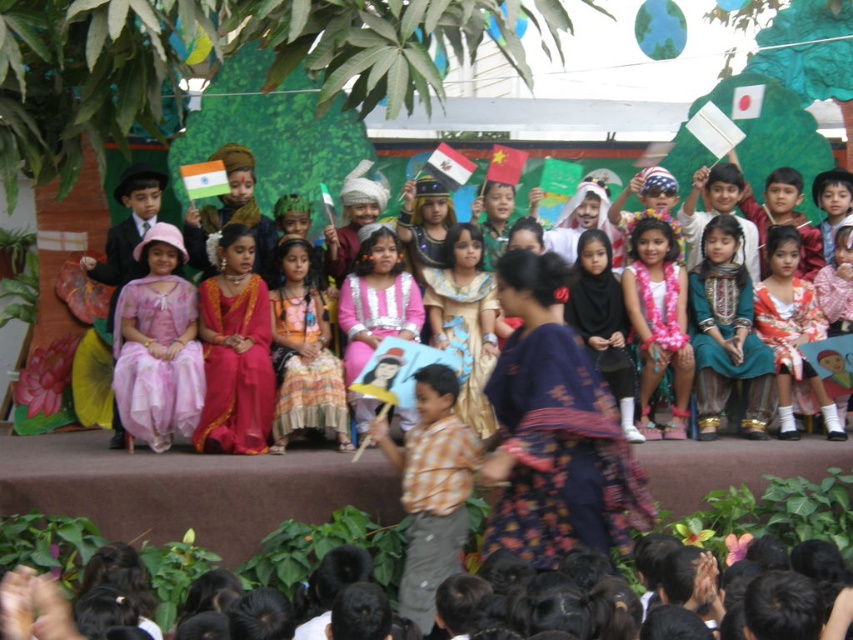
Question: Which point appears farthest from the camera in this image?

Choices:
 (A) 519,168
 (B) 604,529

Answer: (A)

Question: Which object is closer to the camera taking this photo?

Choices:
 (A) multicolored fabric dress at center
 (B) matte pink sari at center

Answer: (B)

Question: Which is nearer to the dark blue floral fabric dress at center?

Choices:
 (A) white paper flag at center
 (B) multicolored fabric dress at center
 (C) matte pink sari at center

Answer: (C)

Question: Can you confirm if multicolored fabric dress at center is thinner than red fabric flag at center?

Choices:
 (A) no
 (B) yes

Answer: (B)

Question: Is pink satin dress at left positioned behind gold shiny dress at center?

Choices:
 (A) no
 (B) yes

Answer: (A)

Question: Is dark blue floral fabric dress at center positioned in front of white paper flag at center?

Choices:
 (A) yes
 (B) no

Answer: (A)